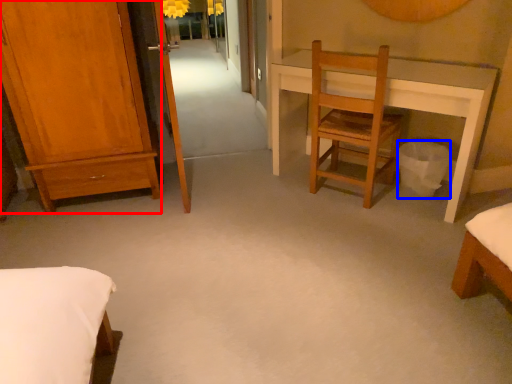
Question: Which point is further to the camera, furniture (highlighted by a red box) or trash bin/can (highlighted by a blue box)?

Choices:
 (A) furniture
 (B) trash bin/can

Answer: (B)